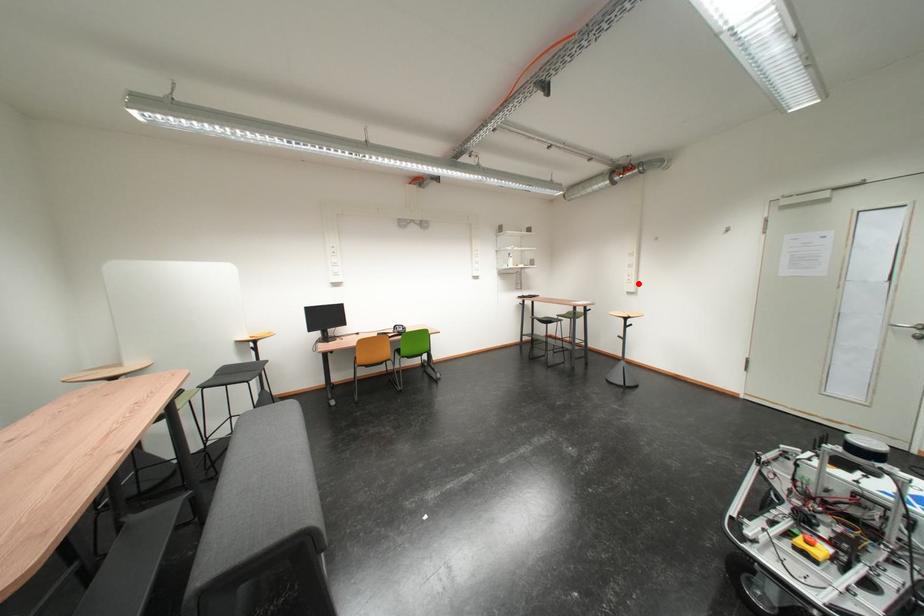
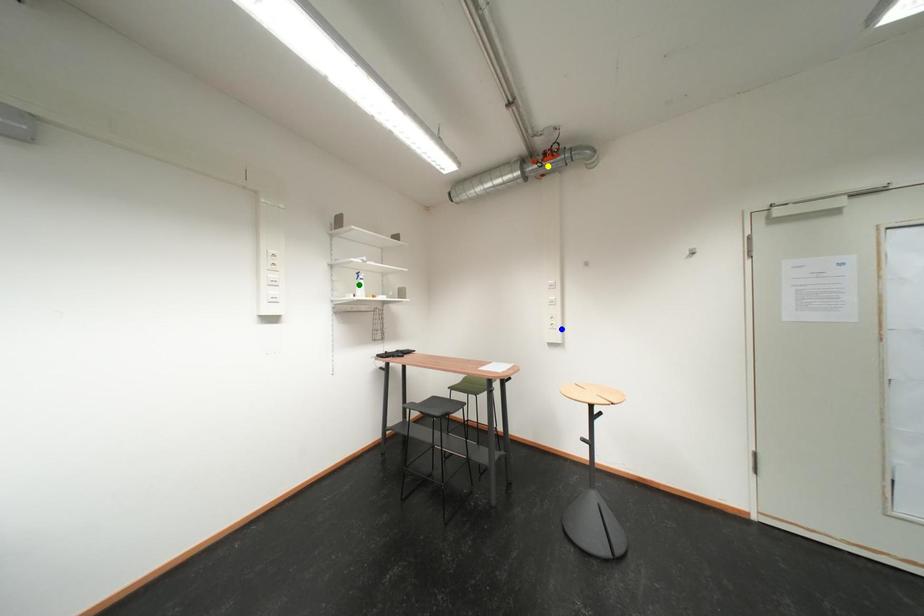
Question: I am providing you with two images of the same scene from different viewpoints. A red point is marked on the first image. You are given multiple points on the second image. Which spot in image 2 lines up with the point in image 1?

Choices:
 (A) blue point
 (B) green point
 (C) yellow point

Answer: (A)